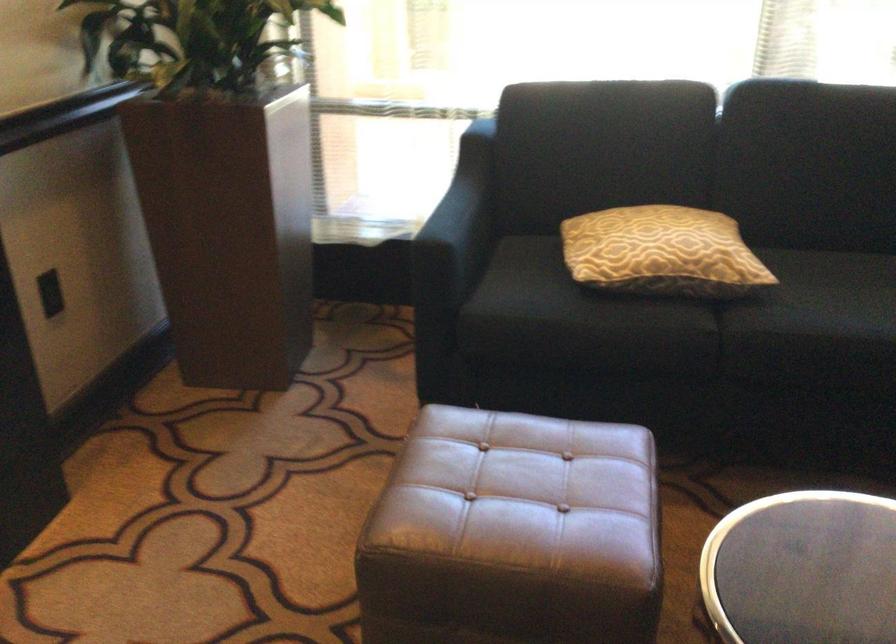
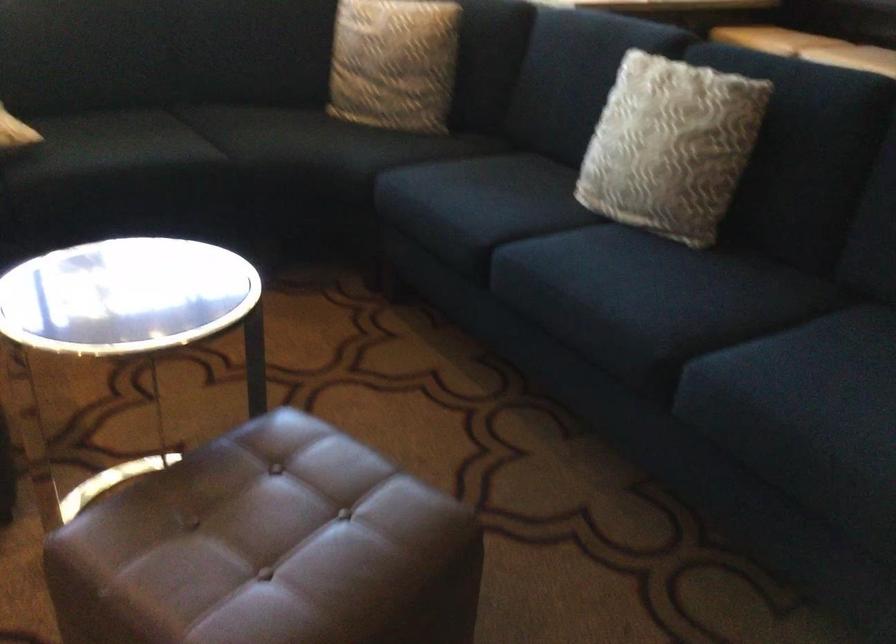
Question: The camera is either moving clockwise (left) or counter-clockwise (right) around the object. The first image is from the beginning of the video and the second image is from the end. Is the camera moving left or right when shooting the video?

Choices:
 (A) Left
 (B) Right

Answer: (A)